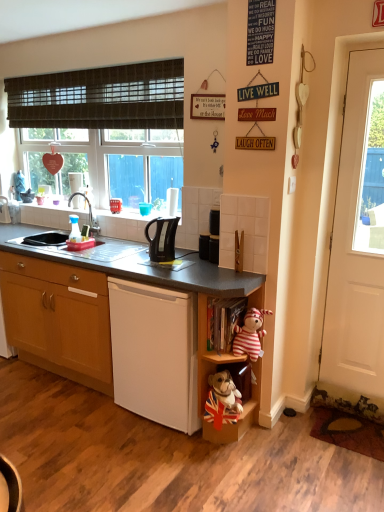
Locate an element on the screen. free space to the left of wooden bookshelf at lower center, acting as the second shelf starting from the top is located at coordinates (174, 442).